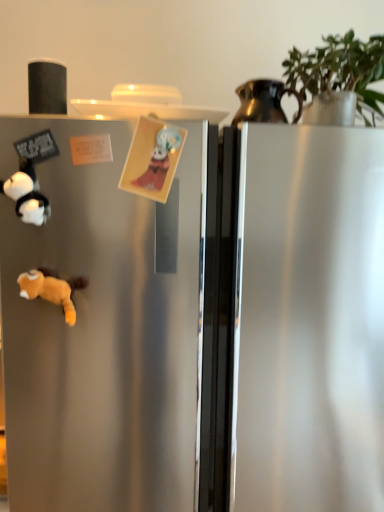
Question: Is white plush panda at left, marked as the second toy in a right-to-left arrangement, at the left side of metallic pitcher at upper right?

Choices:
 (A) yes
 (B) no

Answer: (A)

Question: Is white plush panda at left, marked as the second toy in a right-to-left arrangement, turned away from metallic pitcher at upper right?

Choices:
 (A) yes
 (B) no

Answer: (B)

Question: Does white plush panda at left, marked as the second toy in a right-to-left arrangement, have a greater height compared to metallic pitcher at upper right?

Choices:
 (A) no
 (B) yes

Answer: (A)

Question: Considering the relative sizes of white plush panda at left, which ranks as the first toy in left-to-right order, and metallic pitcher at upper right in the image provided, is white plush panda at left, which ranks as the first toy in left-to-right order, shorter than metallic pitcher at upper right?

Choices:
 (A) yes
 (B) no

Answer: (A)

Question: From a real-world perspective, is white plush panda at left, which ranks as the first toy in left-to-right order, located higher than metallic pitcher at upper right?

Choices:
 (A) yes
 (B) no

Answer: (B)

Question: Is matte paper card at center, placed as the 1th toy when sorted from right to left, bigger or smaller than green matte plant at upper right?

Choices:
 (A) small
 (B) big

Answer: (A)

Question: In terms of height, does matte paper card at center, placed as the 2th toy when sorted from left to right, look taller or shorter compared to green matte plant at upper right?

Choices:
 (A) short
 (B) tall

Answer: (A)

Question: Does point [152, 187] appear closer or farther from the camera than point [337, 52]?

Choices:
 (A) closer
 (B) farther

Answer: (A)

Question: From the image's perspective, is matte paper card at center, placed as the 2th toy when sorted from left to right, positioned above or below green matte plant at upper right?

Choices:
 (A) above
 (B) below

Answer: (B)

Question: In terms of size, does white plush panda at left, which ranks as the first toy in left-to-right order, appear bigger or smaller than fluffy orange stuffed animal at lower left?

Choices:
 (A) small
 (B) big

Answer: (A)

Question: Considering the positions of white plush panda at left, which ranks as the first toy in left-to-right order, and fluffy orange stuffed animal at lower left in the image, is white plush panda at left, which ranks as the first toy in left-to-right order, taller or shorter than fluffy orange stuffed animal at lower left?

Choices:
 (A) tall
 (B) short

Answer: (A)

Question: Relative to fluffy orange stuffed animal at lower left, is white plush panda at left, marked as the second toy in a right-to-left arrangement, in front or behind?

Choices:
 (A) front
 (B) behind

Answer: (A)

Question: From the image's perspective, is white plush panda at left, marked as the second toy in a right-to-left arrangement, positioned above or below fluffy orange stuffed animal at lower left?

Choices:
 (A) above
 (B) below

Answer: (A)

Question: Looking at their shapes, would you say fluffy orange stuffed animal at lower left is wider or thinner than green matte plant at upper right?

Choices:
 (A) thin
 (B) wide

Answer: (A)

Question: From the image's perspective, relative to green matte plant at upper right, is fluffy orange stuffed animal at lower left above or below?

Choices:
 (A) below
 (B) above

Answer: (A)